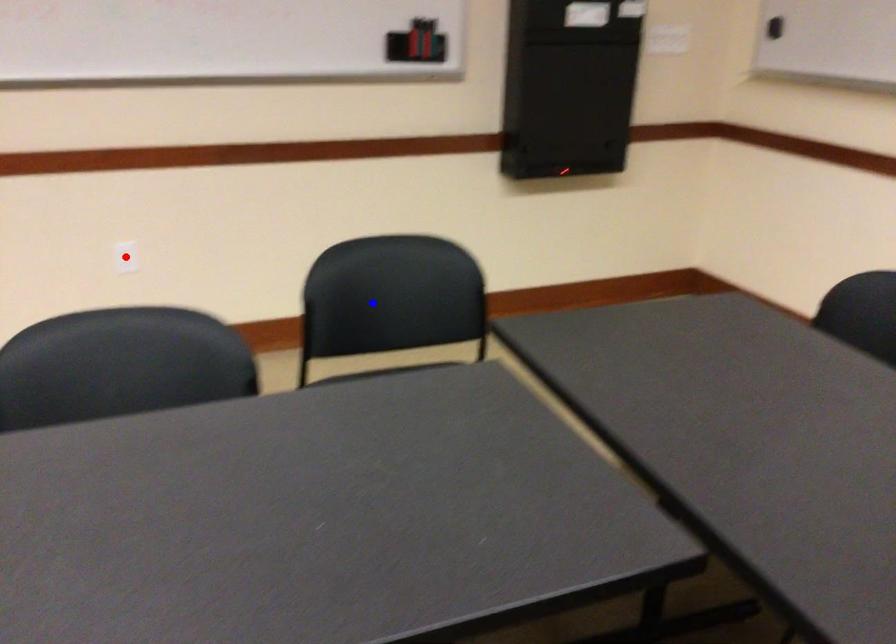
Question: Two points are marked on the image. Which point is closer to the camera?

Choices:
 (A) Blue point is closer.
 (B) Red point is closer.

Answer: (A)